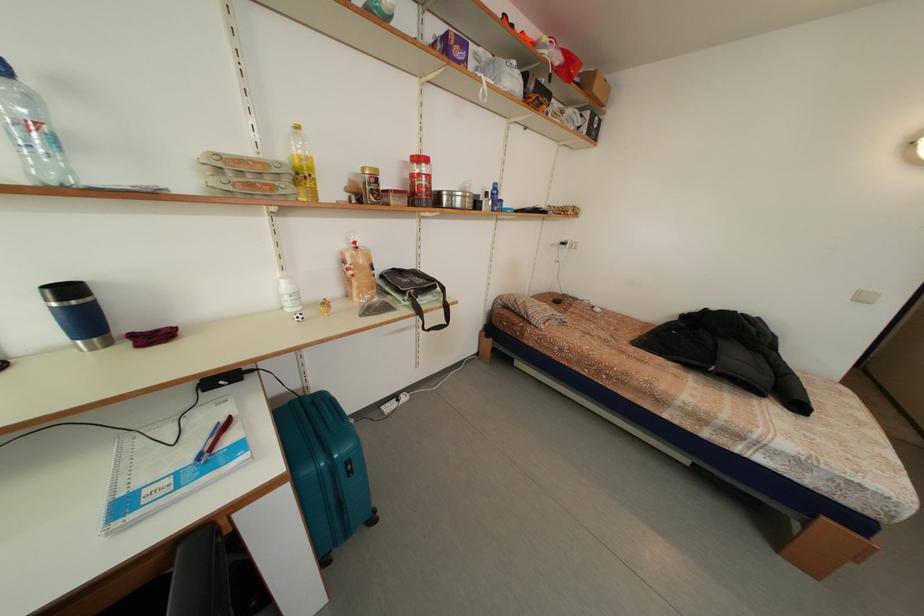
Which object does [78,314] point to?

It refers to a blue travel mug.